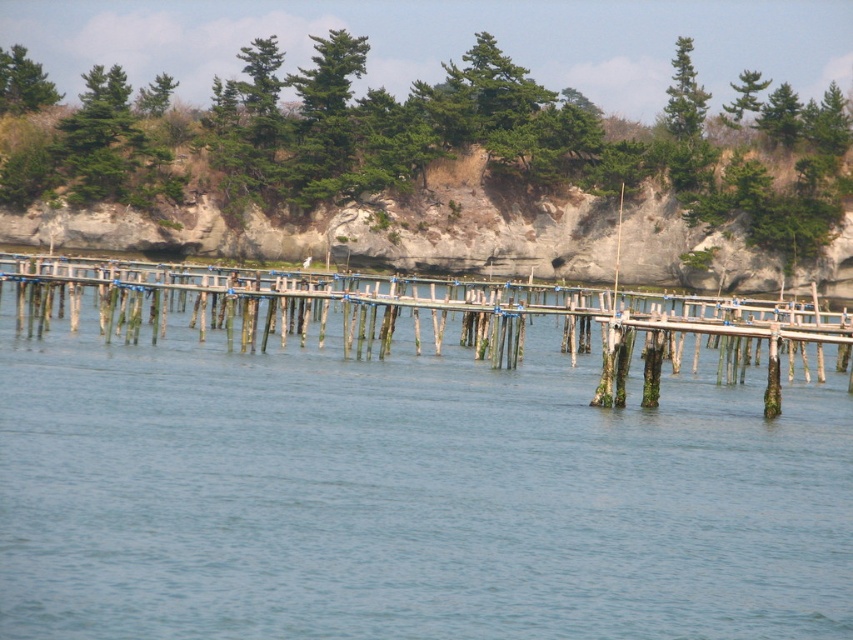
Question: Which of these objects is positioned closest to the clear blue water at center?

Choices:
 (A) wooden dock at center
 (B) rocky cliff at upper center

Answer: (A)

Question: Which point is closer to the camera?

Choices:
 (A) clear blue water at center
 (B) wooden dock at center

Answer: (A)

Question: Which object is closer to the camera taking this photo?

Choices:
 (A) rocky cliff at upper center
 (B) clear blue water at center

Answer: (B)

Question: Does clear blue water at center lie in front of rocky cliff at upper center?

Choices:
 (A) no
 (B) yes

Answer: (B)

Question: Does rocky cliff at upper center appear over wooden dock at center?

Choices:
 (A) yes
 (B) no

Answer: (A)

Question: Is clear blue water at center further to camera compared to wooden dock at center?

Choices:
 (A) yes
 (B) no

Answer: (B)